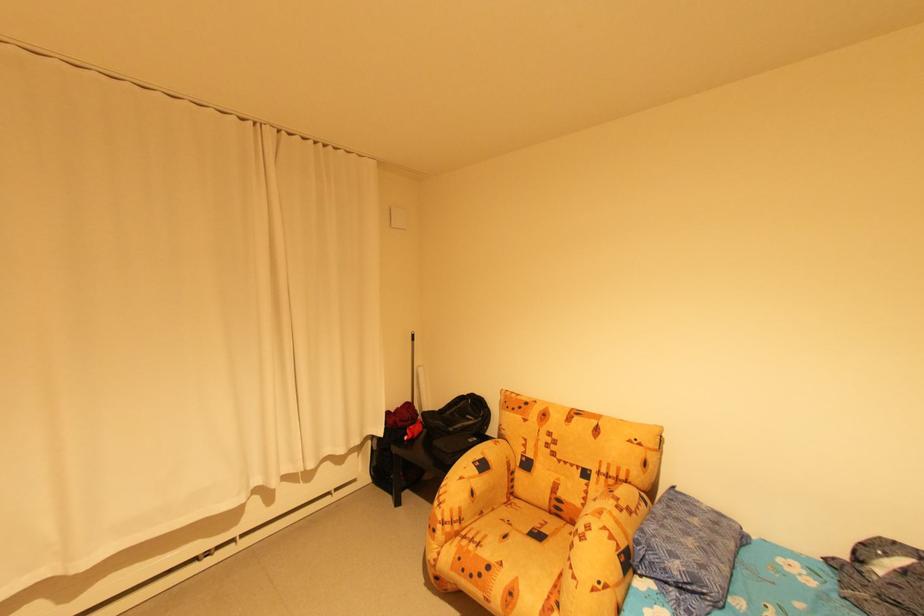
Find the location of `long white pole`. long white pole is located at coordinates (411, 368).